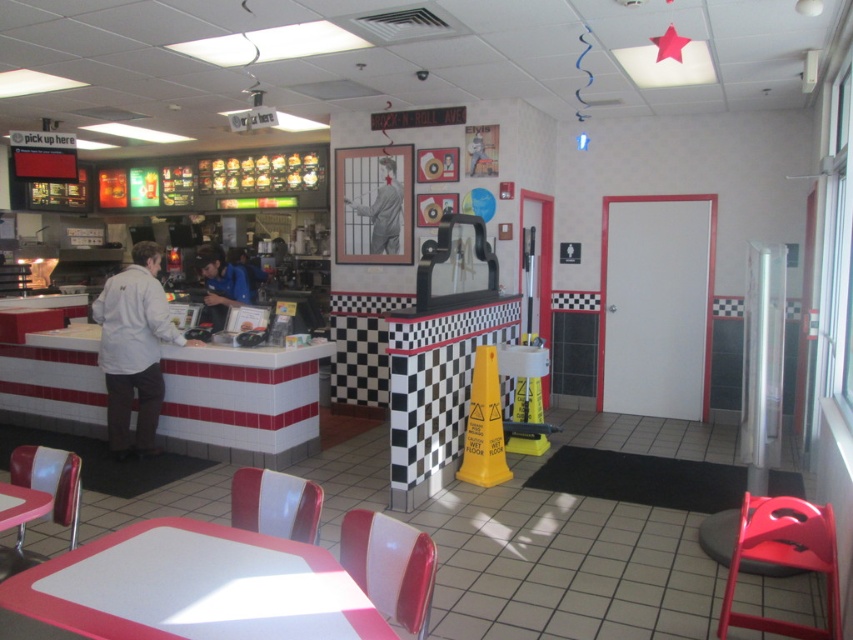
You are a delivery person entering the diner and need to place a large pizza box on the table. The pizza box is 30 cm wide. Can the white glossy table at center accommodate the pizza box in terms of width compared to the matte plastic chair at lower left?

The white glossy table at center is wider than the matte plastic chair at lower left. Since the pizza box is 30 cm wide, the table should have enough width to accommodate it as it is wider than the chair.

You are a customer entering the diner and need to choose between the white vinyl chair at lower center and the matte plastic chair at lower left. Which chair has a wider seat to sit on?

The matte plastic chair at lower left has a wider seat than the white vinyl chair at lower center because the white vinyl chair at lower center is narrower in width according to the description.